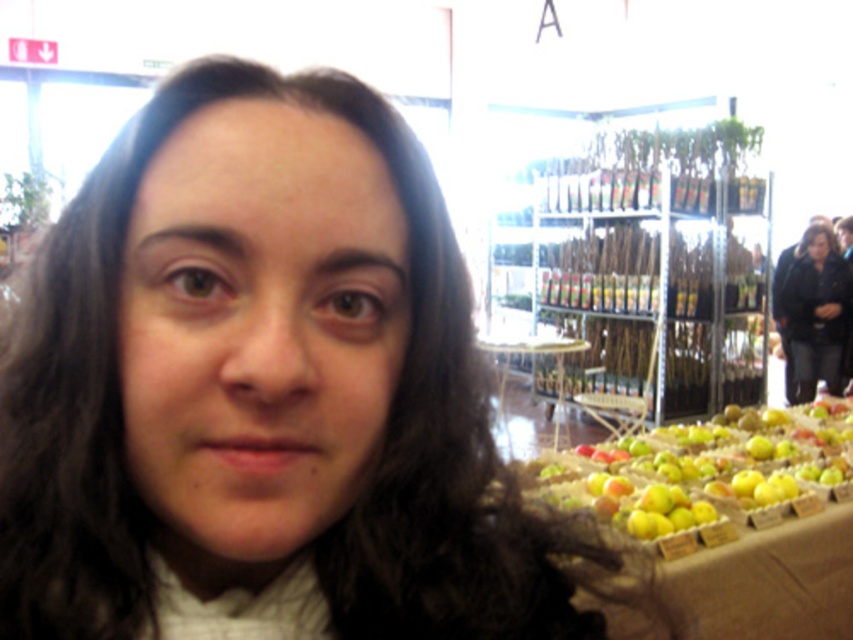
Which of these two, green matte apples at lower right or clear glass table at center, stands taller?

Standing taller between the two is clear glass table at center.

Does point (828, 596) lie in front of point (541, 339)?

Yes.

Which is behind, point (575, 596) or point (558, 390)?

The point (558, 390) is behind.

Find the location of a particular element. Image resolution: width=853 pixels, height=640 pixels. green matte apples at lower right is located at coordinates (734, 524).

Does green matte apples at lower right have a larger size compared to black leather jacket at right?

Indeed, green matte apples at lower right has a larger size compared to black leather jacket at right.

Which is behind, point (849, 451) or point (838, 305)?

Positioned behind is point (838, 305).

Based on the photo, who is more distant from viewer, (686, 598) or (817, 264)?

Point (817, 264)

Find the location of a particular element. This screenshot has height=640, width=853. green matte apples at lower right is located at coordinates (734, 524).

Between black leather jacket at right and clear glass table at center, which one appears on the right side from the viewer's perspective?

Positioned to the right is black leather jacket at right.

Describe the element at coordinates (814, 314) in the screenshot. I see `black leather jacket at right` at that location.

Is point (817, 374) positioned before point (500, 353)?

No, it is behind (500, 353).

You are a GUI agent. You are given a task and a screenshot of the screen. Output one action in this format:
    pyautogui.click(x=<x>, y=<y>)
    Task: Click on the black leather jacket at right
    The height and width of the screenshot is (640, 853).
    Given the screenshot: What is the action you would take?
    pyautogui.click(x=814, y=314)